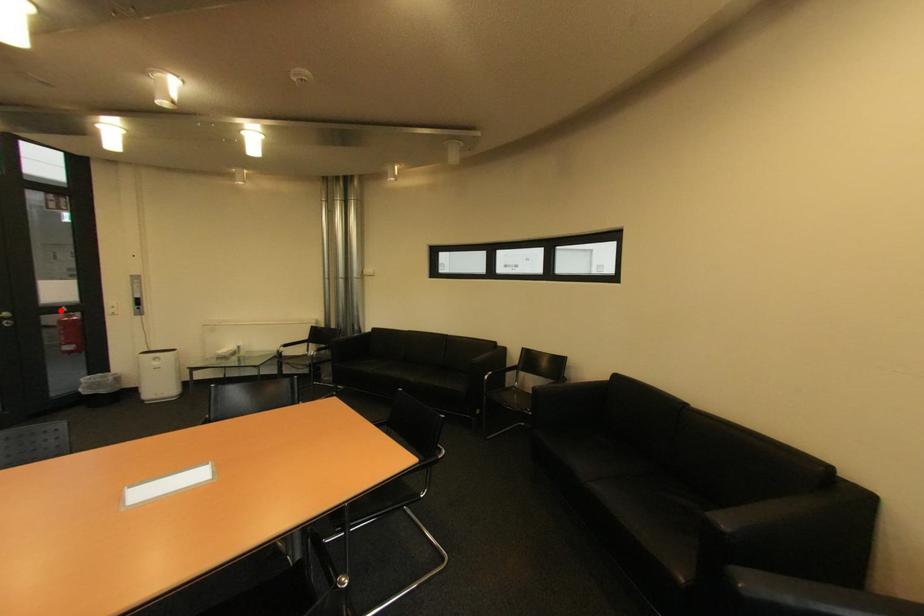
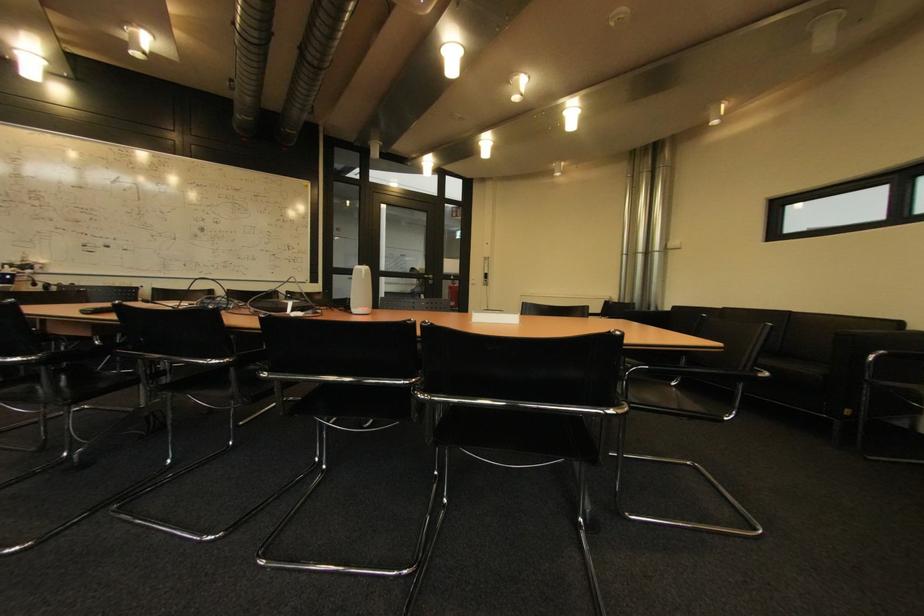
Find the pixel in the second image that matches the highlighted location in the first image.

(456, 278)